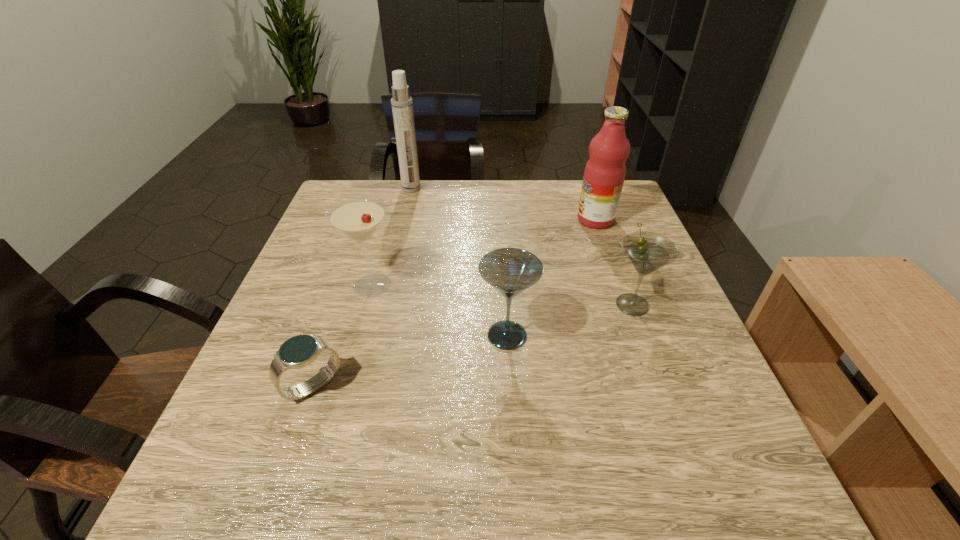
Where is `free space located on the label of the second farthest object`? free space located on the label of the second farthest object is located at coordinates (484, 220).

At what (x,y) coordinates should I click in order to perform the action: click on vacant space situated on the back of the leftmost martini. Please return your answer as a coordinate pair (x, y). This screenshot has width=960, height=540. Looking at the image, I should click on (396, 199).

Locate an element on the screen. blank space located 0.120m on the back of the second martini from left to right is located at coordinates (503, 278).

The height and width of the screenshot is (540, 960). What are the coordinates of `free location located 0.210m on the back of the rightmost martini` in the screenshot? It's located at (606, 233).

What are the coordinates of `free region located on the right of the shortest object` in the screenshot? It's located at (460, 386).

Locate an element on the screen. The image size is (960, 540). aerosol can present at the far edge is located at coordinates (402, 106).

Identify the location of fruit juice located in the far edge section of the desktop. (604, 174).

Identify the location of martini at the left edge. The image size is (960, 540). (359, 218).

Find the location of a particular element. Image resolution: width=960 pixels, height=540 pixels. watch that is at the left edge is located at coordinates (301, 350).

The image size is (960, 540). Find the location of `fruit juice that is at the right edge`. fruit juice that is at the right edge is located at coordinates (604, 174).